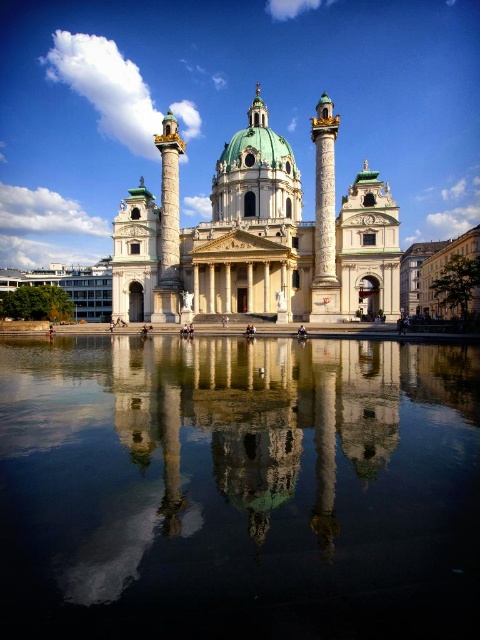
Is gold-carved column at center bigger than gold polished column at center?

Yes.

Is gold-carved column at center smaller than gold polished column at center?

Incorrect, gold-carved column at center is not smaller in size than gold polished column at center.

Between point (334, 128) and point (168, 136), which one is positioned behind?

Positioned behind is point (168, 136).

What are the coordinates of `gold-carved column at center` in the screenshot? It's located at (324, 216).

You are a GUI agent. You are given a task and a screenshot of the screen. Output one action in this format:
    pyautogui.click(x=<x>, y=<y>)
    Task: Click on the white marble church at center
    The height and width of the screenshot is (640, 480).
    Given the screenshot: What is the action you would take?
    pyautogui.click(x=257, y=236)

Is point (144, 241) behind point (331, 163)?

Yes, it is.

Is point (124, 220) closer to viewer compared to point (328, 280)?

No, it is behind (328, 280).

Where is `white marble church at center`? white marble church at center is located at coordinates (257, 236).

Which is behind, point (219, 401) or point (324, 244)?

The point (324, 244) is more distant.

Is transparent glass water at center smaller than gold-carved column at center?

Incorrect, transparent glass water at center is not smaller in size than gold-carved column at center.

Between point (347, 589) and point (333, 134), which one is positioned behind?

Point (333, 134)

Locate an element on the screen. The image size is (480, 640). transparent glass water at center is located at coordinates (239, 490).